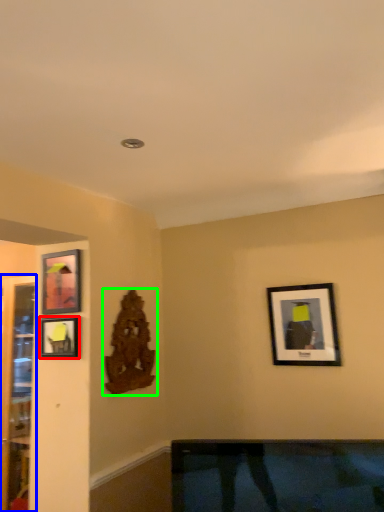
Question: Which is farther away from picture frame (highlighted by a red box)? glass door (highlighted by a blue box) or art (highlighted by a green box)?

Choices:
 (A) glass door
 (B) art

Answer: (A)